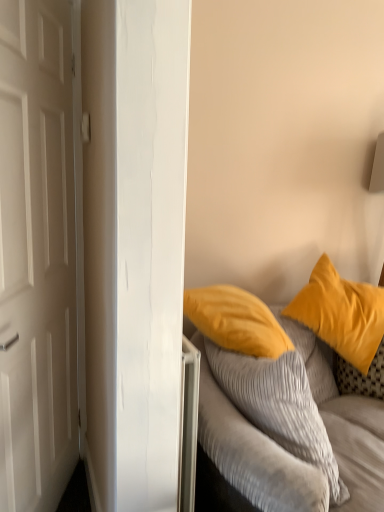
Question: Is white matte door at left oriented towards soft yellow pillow at right?

Choices:
 (A) yes
 (B) no

Answer: (A)

Question: From the image's perspective, is white matte door at left over soft yellow pillow at right?

Choices:
 (A) yes
 (B) no

Answer: (A)

Question: Can you confirm if white matte door at left is bigger than soft yellow pillow at right?

Choices:
 (A) yes
 (B) no

Answer: (A)

Question: Considering the relative positions of white matte door at left and soft yellow pillow at right in the image provided, is white matte door at left to the right of soft yellow pillow at right from the viewer's perspective?

Choices:
 (A) yes
 (B) no

Answer: (B)

Question: Can you confirm if white matte door at left is positioned to the left of soft yellow pillow at right?

Choices:
 (A) yes
 (B) no

Answer: (A)

Question: From a real-world perspective, is white matte door at left positioned under soft yellow pillow at right based on gravity?

Choices:
 (A) no
 (B) yes

Answer: (A)

Question: Is soft yellow pillow at right oriented towards matte yellow pillow at upper right?

Choices:
 (A) yes
 (B) no

Answer: (A)

Question: Considering the relative sizes of soft yellow pillow at right and matte yellow pillow at upper right in the image provided, is soft yellow pillow at right shorter than matte yellow pillow at upper right?

Choices:
 (A) no
 (B) yes

Answer: (B)

Question: Is soft yellow pillow at right bigger than matte yellow pillow at upper right?

Choices:
 (A) no
 (B) yes

Answer: (A)

Question: Is matte yellow pillow at upper right located within soft yellow pillow at right?

Choices:
 (A) yes
 (B) no

Answer: (B)

Question: Is soft yellow pillow at right placed right next to matte yellow pillow at upper right?

Choices:
 (A) yes
 (B) no

Answer: (B)

Question: Can you confirm if soft yellow pillow at right is positioned to the left of matte yellow pillow at upper right?

Choices:
 (A) yes
 (B) no

Answer: (A)

Question: From the image's perspective, is soft yellow pillow at right below white matte door at left?

Choices:
 (A) yes
 (B) no

Answer: (A)